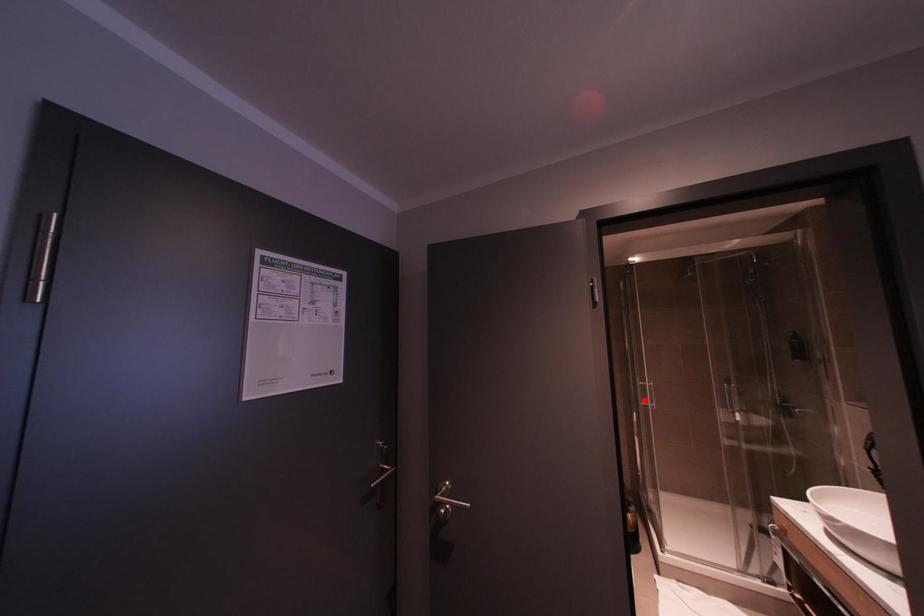
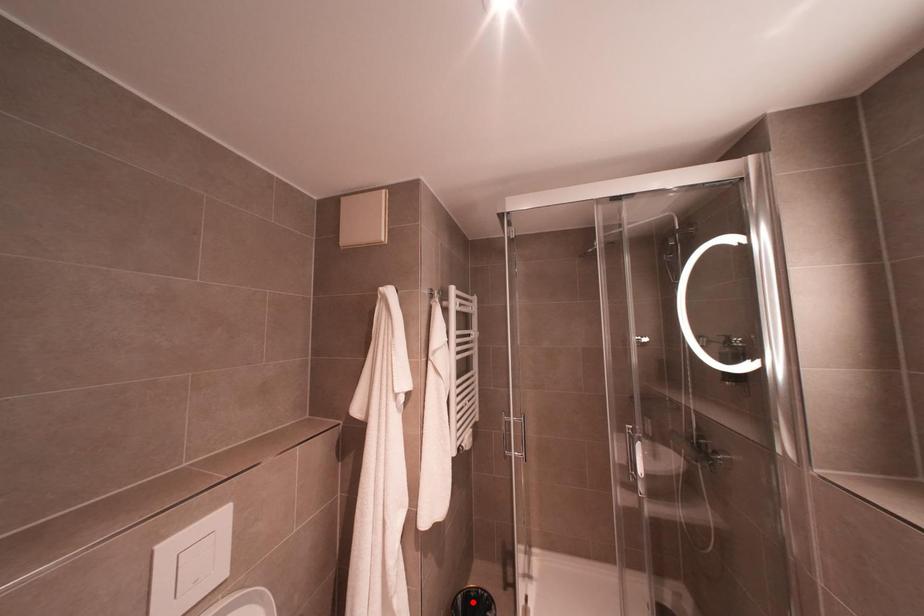
I am providing you with two images of the same scene from different viewpoints. A red point is marked on the first image and another point is marked on the second image. Is the marked point in image1 the same physical position as the marked point in image2?

No